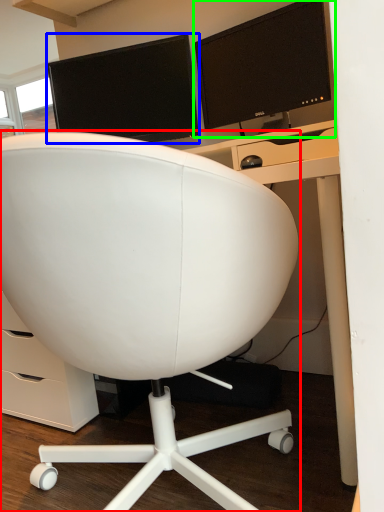
Question: Based on their relative distances, which object is nearer to chair (highlighted by a red box)? Choose from computer monitor (highlighted by a blue box) and computer monitor (highlighted by a green box).

Choices:
 (A) computer monitor
 (B) computer monitor

Answer: (B)